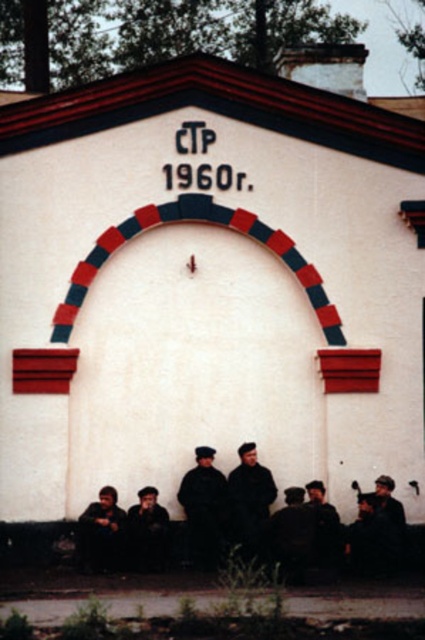
You are a photographer trying to capture a group photo of the people in the scene. You notice the dark gray uniform at center and the dark brown leather jacket at lower left. Which clothing item should you focus on first if you want to ensure both are clearly visible in the photo?

The dark gray uniform at center is bigger than the dark brown leather jacket at lower left, so focusing on the dark gray uniform at center first will ensure both are clearly visible in the photo.

You are a photographer trying to capture a clear shot of the dark gray uniform at center and the dark brown leather jacket at lower left. Since you want both subjects in focus, which one should you position closer to the camera to ensure depth of field?

The dark brown leather jacket at lower left is behind the dark gray uniform at center, so to ensure both are in focus, position the dark gray uniform at center closer to the camera. This way, the jacket behind it will naturally fall within the depth of field range.